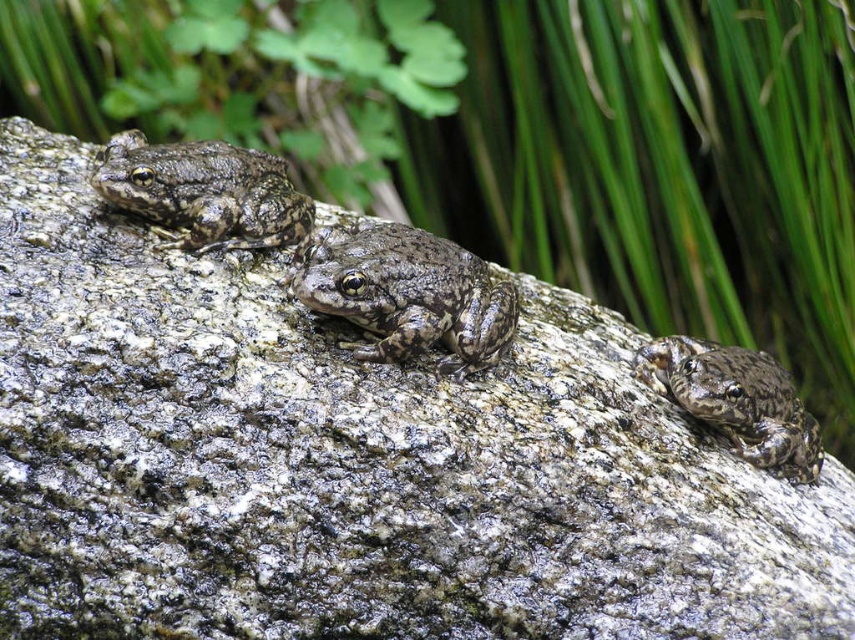
Question: Does camouflage skin frog at center appear over camouflage skin frog at lower right?

Choices:
 (A) no
 (B) yes

Answer: (B)

Question: Estimate the real-world distances between objects in this image. Which object is closer to the camouflage skin frog at center?

Choices:
 (A) camouflage skin frog at lower right
 (B) camouflage skin frog at left

Answer: (B)

Question: Which object appears farthest from the camera in this image?

Choices:
 (A) camouflage skin frog at lower right
 (B) camouflage skin frog at center
 (C) camouflage skin frog at left

Answer: (A)

Question: Based on their relative distances, which object is farther from the camouflage skin frog at center?

Choices:
 (A) camouflage skin frog at lower right
 (B) camouflage skin frog at left

Answer: (A)

Question: Is camouflage skin frog at left positioned in front of camouflage skin frog at lower right?

Choices:
 (A) no
 (B) yes

Answer: (B)

Question: Is camouflage skin frog at center to the left of camouflage skin frog at left from the viewer's perspective?

Choices:
 (A) no
 (B) yes

Answer: (A)